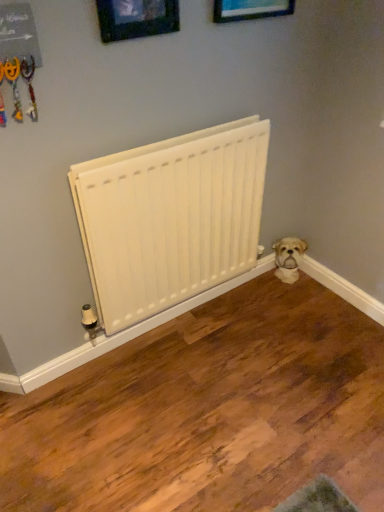
Where is `vacant space that is in between white fluffy dog at lower right and white matte radiator at center`? Image resolution: width=384 pixels, height=512 pixels. vacant space that is in between white fluffy dog at lower right and white matte radiator at center is located at coordinates (239, 310).